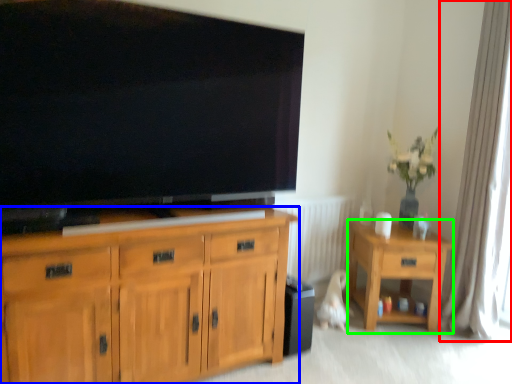
Question: Which object is positioned farthest from curtain (highlighted by a red box)? Select from cabinetry (highlighted by a blue box) and desk (highlighted by a green box).

Choices:
 (A) cabinetry
 (B) desk

Answer: (A)